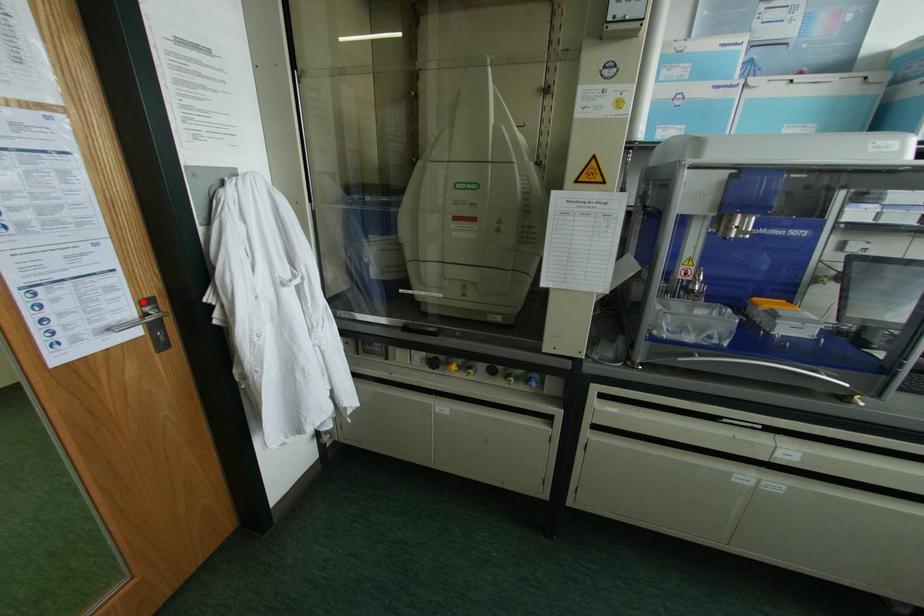
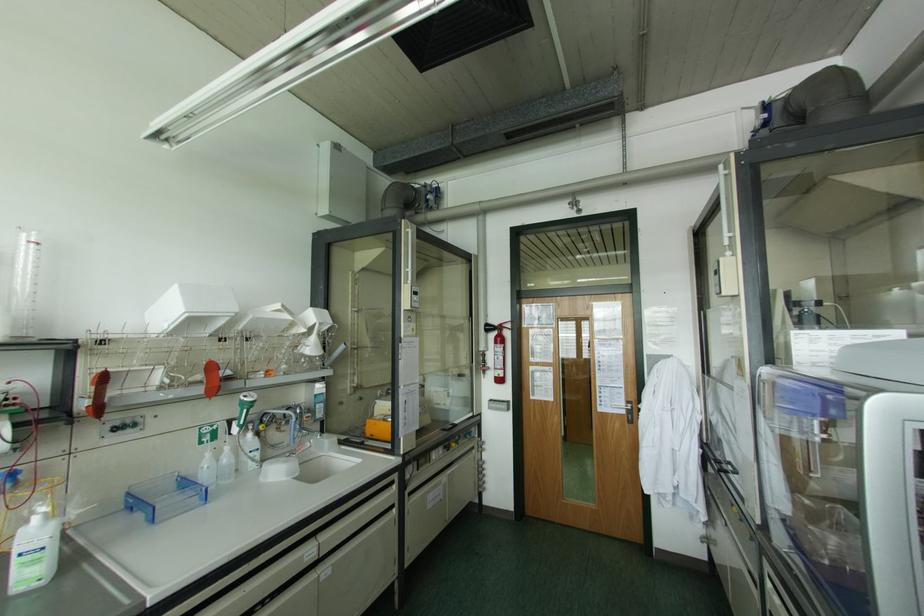
Question: I am providing you with two images of the same scene from different viewpoints. A red point is marked on the first image. Can you still see the location of the red point in image 2?

Choices:
 (A) Yes
 (B) No

Answer: (A)